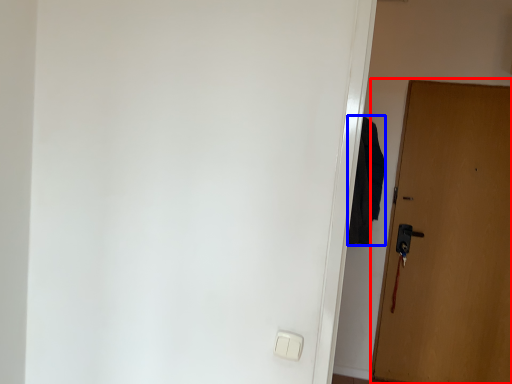
Question: Which of the following is the farthest to the observer, door (highlighted by a red box) or robe (highlighted by a blue box)?

Choices:
 (A) door
 (B) robe

Answer: (A)